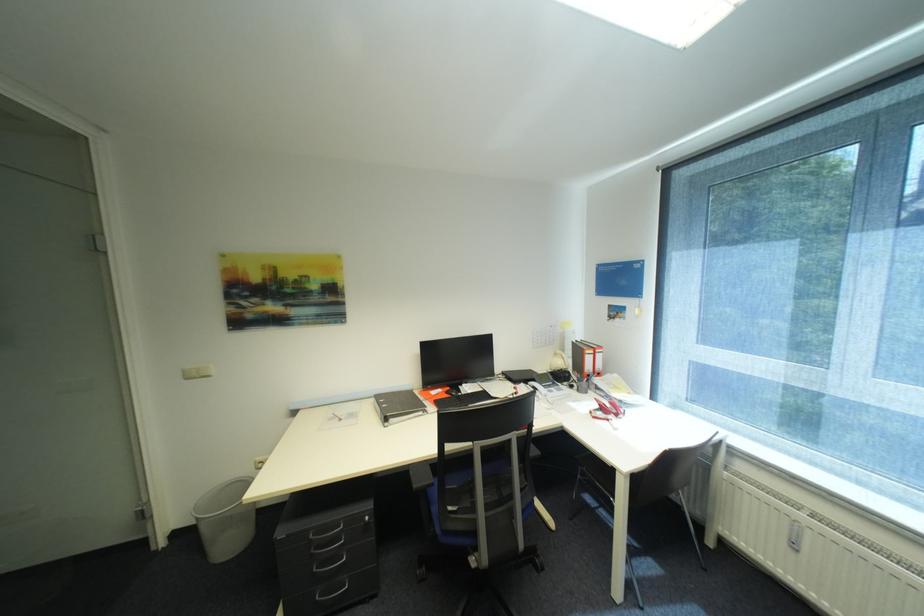
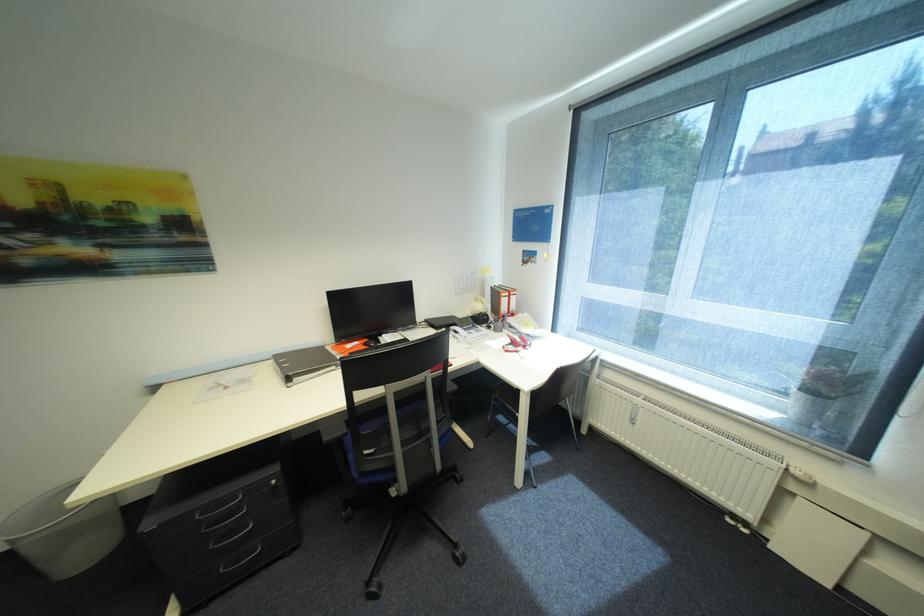
What movement of the cameraman would produce the second image?

The cameraman walked toward right, forward.